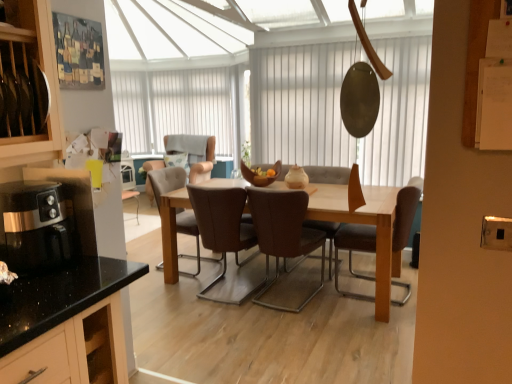
Question: Is brown leather chair at center, acting as the 4th chair starting from the front, not within beige fabric chair at center, the sixth chair viewed from the front?

Choices:
 (A) yes
 (B) no

Answer: (A)

Question: From the image's perspective, is brown leather chair at center, marked as the third chair in a back-to-front arrangement, located above beige fabric chair at center, which is the first chair in back-to-front order?

Choices:
 (A) no
 (B) yes

Answer: (A)

Question: Is brown leather chair at center, marked as the third chair in a back-to-front arrangement, positioned in front of beige fabric chair at center, the sixth chair viewed from the front?

Choices:
 (A) no
 (B) yes

Answer: (B)

Question: Is brown leather chair at center, acting as the 4th chair starting from the front, far from beige fabric chair at center, the sixth chair viewed from the front?

Choices:
 (A) yes
 (B) no

Answer: (B)

Question: Can you confirm if brown leather chair at center, marked as the third chair in a back-to-front arrangement, is shorter than beige fabric chair at center, the sixth chair viewed from the front?

Choices:
 (A) yes
 (B) no

Answer: (B)

Question: From the image's perspective, would you say brown leather chair at center, marked as the third chair in a back-to-front arrangement, is shown under beige fabric chair at center, the sixth chair viewed from the front?

Choices:
 (A) yes
 (B) no

Answer: (A)

Question: Is beige fabric chair at center, which is the first chair in back-to-front order, at the left side of metallic gold window screen at center, which is counted as the 2th window screen, starting from the back?

Choices:
 (A) yes
 (B) no

Answer: (A)

Question: Considering the relative sizes of beige fabric chair at center, which is the first chair in back-to-front order, and metallic gold window screen at center, which ranks as the first window screen in right-to-left order, in the image provided, is beige fabric chair at center, which is the first chair in back-to-front order, smaller than metallic gold window screen at center, which ranks as the first window screen in right-to-left order,?

Choices:
 (A) yes
 (B) no

Answer: (B)

Question: Is metallic gold window screen at center, arranged as the 1th window screen when viewed from the front, a part of beige fabric chair at center, which is the first chair in back-to-front order?

Choices:
 (A) no
 (B) yes

Answer: (A)

Question: Is beige fabric chair at center, the sixth chair viewed from the front, not near metallic gold window screen at center, which ranks as the first window screen in right-to-left order?

Choices:
 (A) no
 (B) yes

Answer: (B)

Question: Is beige fabric chair at center, which is the first chair in back-to-front order, thinner than metallic gold window screen at center, which is counted as the 2th window screen, starting from the back?

Choices:
 (A) no
 (B) yes

Answer: (A)

Question: From the image's perspective, is beige fabric chair at center, which is the first chair in back-to-front order, located beneath metallic gold window screen at center, which appears as the 2th window screen when viewed from the left?

Choices:
 (A) yes
 (B) no

Answer: (A)

Question: Is brown leather chair at center, the 5th chair when ordered from back to front, at the left side of black glossy coffee machine at left?

Choices:
 (A) no
 (B) yes

Answer: (A)